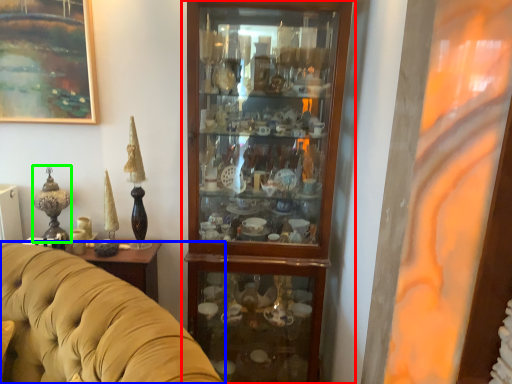
Question: Based on their relative distances, which object is nearer to cupboard (highlighted by a red box)? Choose from studio couch (highlighted by a blue box) and candle holder (highlighted by a green box).

Choices:
 (A) studio couch
 (B) candle holder

Answer: (A)